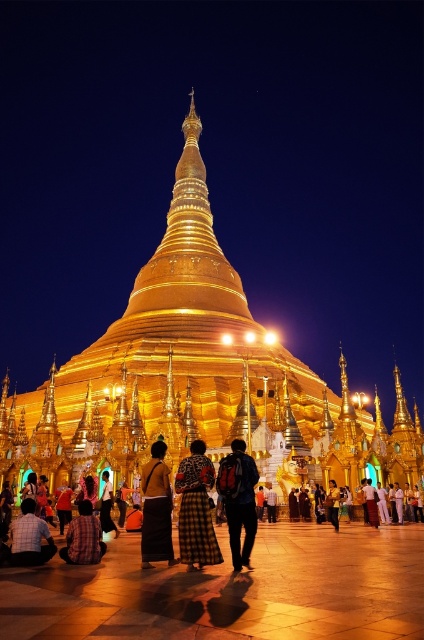
Who is positioned more to the left, plaid fabric skirt at center or yellow fabric bag at center?

plaid fabric skirt at center is more to the left.

Looking at this image, who is lower down, plaid fabric skirt at center or yellow fabric bag at center?

Positioned lower is yellow fabric bag at center.

The image size is (424, 640). Find the location of `plaid fabric skirt at center`. plaid fabric skirt at center is located at coordinates (195, 509).

Who is positioned more to the left, plaid fabric skirt at center or red backpack at center?

plaid fabric skirt at center is more to the left.

Is plaid fabric skirt at center smaller than red backpack at center?

Yes, plaid fabric skirt at center is smaller than red backpack at center.

The height and width of the screenshot is (640, 424). What do you see at coordinates (195, 509) in the screenshot?
I see `plaid fabric skirt at center` at bounding box center [195, 509].

Locate an element on the screen. This screenshot has width=424, height=640. plaid fabric skirt at center is located at coordinates (195, 509).

What do you see at coordinates (156, 508) in the screenshot? This screenshot has width=424, height=640. I see `golden silk skirt at center` at bounding box center [156, 508].

Who is positioned more to the right, golden silk skirt at center or black fabric dress at center?

Positioned to the right is golden silk skirt at center.

At what (x,y) coordinates should I click in order to perform the action: click on golden silk skirt at center. Please return your answer as a coordinate pair (x, y). Looking at the image, I should click on (156, 508).